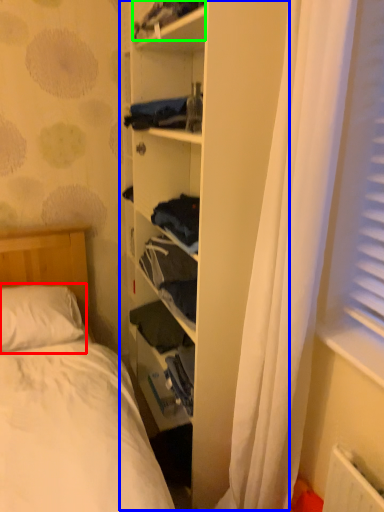
Question: Which object is the closest to the pillow (highlighted by a red box)? Choose among these: bookshelf (highlighted by a blue box) or clothing (highlighted by a green box).

Choices:
 (A) bookshelf
 (B) clothing

Answer: (A)